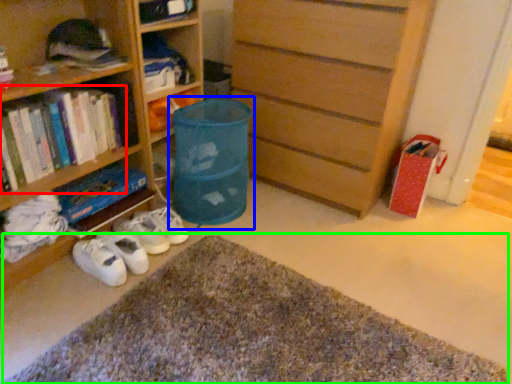
Question: Which object is the closest to the book (highlighted by a red box)? Choose among these: laundry basket (highlighted by a blue box) or doormat (highlighted by a green box).

Choices:
 (A) laundry basket
 (B) doormat

Answer: (A)